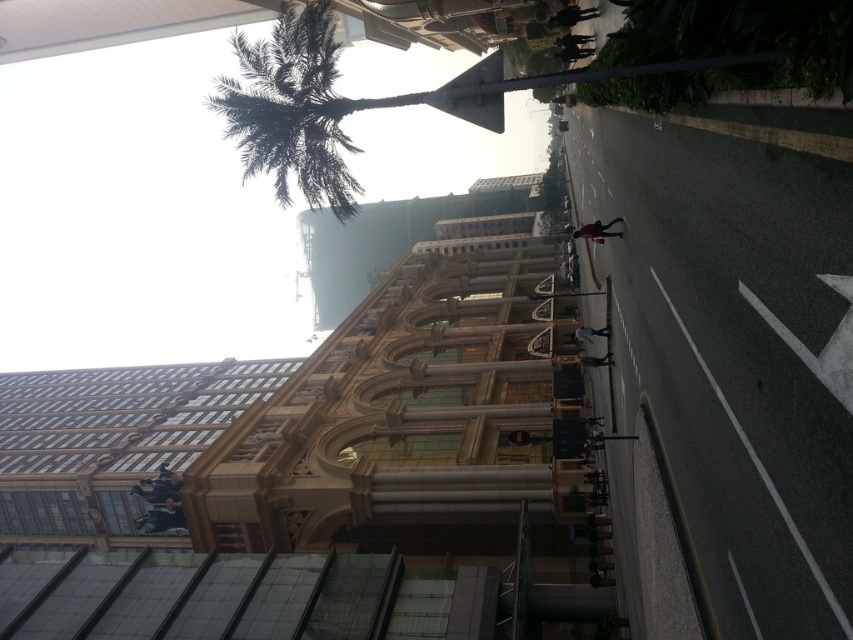
You are a city planner evaluating the urban space. You need to install a new streetlight that must be taller than the existing metallic pole at center. Based on the scene, can the new streetlight be placed near the green leafy palm tree at upper left without blocking its view?

The green leafy palm tree at upper left is larger in size than the metallic pole at center. Since the new streetlight needs to be taller than the existing pole, it could potentially be placed near the palm tree without blocking its view, as the palm tree is already larger and might not require additional clearance.

You are a pedestrian standing on the street and want to reach the metallic pole at center. Which direction should you walk from the green leafy palm tree at upper left to get there?

You should walk to the right from the green leafy palm tree at upper left to reach the metallic pole at center because the metallic pole at center is to the right of the green leafy palm tree at upper left.